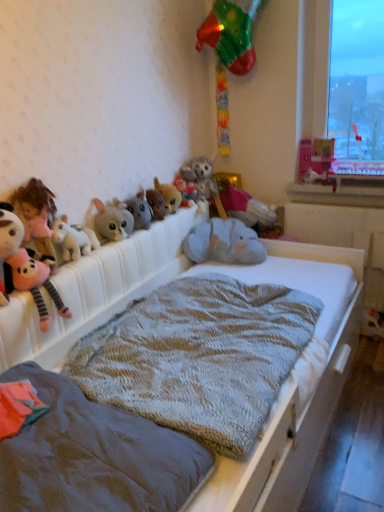
Question: Is the position of textured gray blanket at center less distant than that of fluffy gray plush at center, the sixth toy when ordered from right to left?

Choices:
 (A) yes
 (B) no

Answer: (A)

Question: From the image's perspective, does textured gray blanket at center appear higher than fluffy gray plush at center, the sixth toy when ordered from right to left?

Choices:
 (A) yes
 (B) no

Answer: (B)

Question: Does textured gray blanket at center have a lesser width compared to fluffy gray plush at center, the sixth toy when ordered from right to left?

Choices:
 (A) no
 (B) yes

Answer: (A)

Question: Can you confirm if textured gray blanket at center is wider than fluffy gray plush at center, positioned as the 5th toy in left-to-right order?

Choices:
 (A) no
 (B) yes

Answer: (B)

Question: Is textured gray blanket at center to the left of fluffy gray plush at center, positioned as the 5th toy in left-to-right order, from the viewer's perspective?

Choices:
 (A) yes
 (B) no

Answer: (B)

Question: Is textured gray blanket at center further to camera compared to fluffy gray plush at center, positioned as the 5th toy in left-to-right order?

Choices:
 (A) no
 (B) yes

Answer: (A)

Question: Is textured gray blanket at center outside gray plush elephant at upper center, which ranks as the 9th toy in left-to-right order?

Choices:
 (A) no
 (B) yes

Answer: (B)

Question: From the image's perspective, is textured gray blanket at center beneath gray plush elephant at upper center, which ranks as the 9th toy in left-to-right order?

Choices:
 (A) yes
 (B) no

Answer: (A)

Question: Is textured gray blanket at center far from gray plush elephant at upper center, marked as the second toy in a right-to-left arrangement?

Choices:
 (A) no
 (B) yes

Answer: (A)

Question: Does textured gray blanket at center have a greater width compared to gray plush elephant at upper center, marked as the second toy in a right-to-left arrangement?

Choices:
 (A) yes
 (B) no

Answer: (A)

Question: Is textured gray blanket at center placed right next to gray plush elephant at upper center, marked as the second toy in a right-to-left arrangement?

Choices:
 (A) no
 (B) yes

Answer: (A)

Question: Is textured gray blanket at center positioned in front of gray plush elephant at upper center, marked as the second toy in a right-to-left arrangement?

Choices:
 (A) yes
 (B) no

Answer: (A)

Question: Is pink plush toy at left, which is counted as the first toy, starting from the left, not inside fluffy gray plush at center, the 7th toy viewed from the right?

Choices:
 (A) no
 (B) yes

Answer: (B)